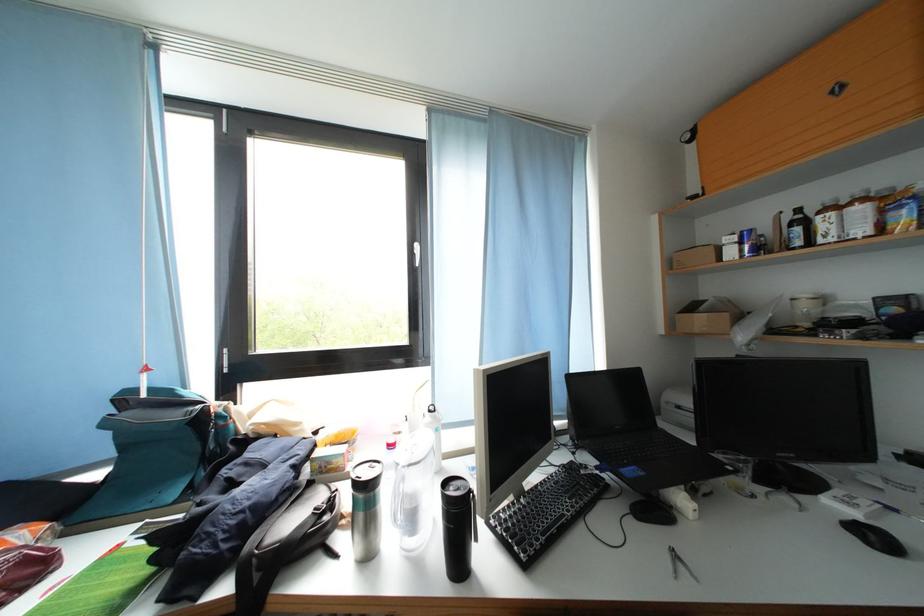
Which object does [154,450] point to?

It corresponds to the teal backpack in the image.